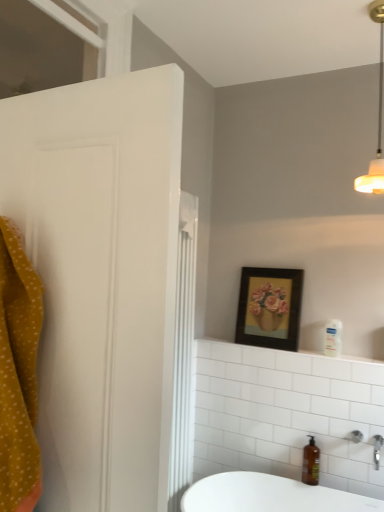
Question: From the image's perspective, is white glossy shelf at upper center located above or below white matte light fixture at upper right?

Choices:
 (A) above
 (B) below

Answer: (B)

Question: From a real-world perspective, is white glossy shelf at upper center physically located above or below white matte light fixture at upper right?

Choices:
 (A) above
 (B) below

Answer: (B)

Question: Which of these objects is positioned farthest from the wooden framed picture at upper center?

Choices:
 (A) transparent glass window at upper left
 (B) white matte light fixture at upper right
 (C) clear plastic pump bottle at upper right
 (D) brown glass soap dispenser at lower right
 (E) silver metallic faucet at lower right

Answer: (A)

Question: Considering the real-world distances, which object is closest to the white glossy shelf at upper center?

Choices:
 (A) wooden framed picture at upper center
 (B) clear plastic pump bottle at upper right
 (C) silver metallic faucet at lower right
 (D) transparent glass window at upper left
 (E) brown glass soap dispenser at lower right

Answer: (B)